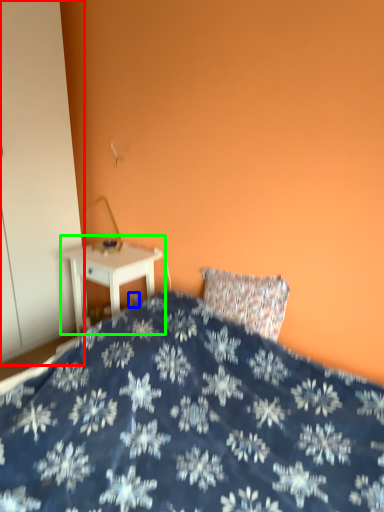
Question: Estimate the real-world distances between objects in this image. Which object is farther from armoire (highlighted by a red box), electric outlet (highlighted by a blue box) or nightstand (highlighted by a green box)?

Choices:
 (A) electric outlet
 (B) nightstand

Answer: (A)